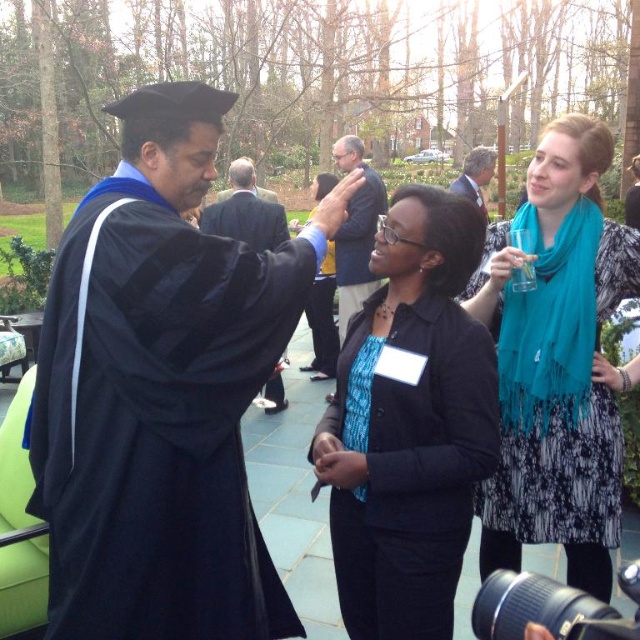
Question: Which is farther from the black matte blazer at center?

Choices:
 (A) matte black graduation gown at left
 (B) black matte suit at center

Answer: (B)

Question: Can you confirm if black matte blazer at center is wider than teal scarf at upper right?

Choices:
 (A) no
 (B) yes

Answer: (A)

Question: Does black matte suit at center have a greater width compared to gray wool suit at center?

Choices:
 (A) no
 (B) yes

Answer: (B)

Question: Which point appears closest to the camera in this image?

Choices:
 (A) (404, 525)
 (B) (54, 268)
 (C) (266, 396)
 (D) (344, 136)

Answer: (B)

Question: Which object is positioned closest to the black matte blazer at center?

Choices:
 (A) gray wool suit at center
 (B) dark blue suit at center
 (C) teal scarf at upper right

Answer: (C)

Question: Is matte black graduation gown at left wider than dark blue suit at center?

Choices:
 (A) yes
 (B) no

Answer: (A)